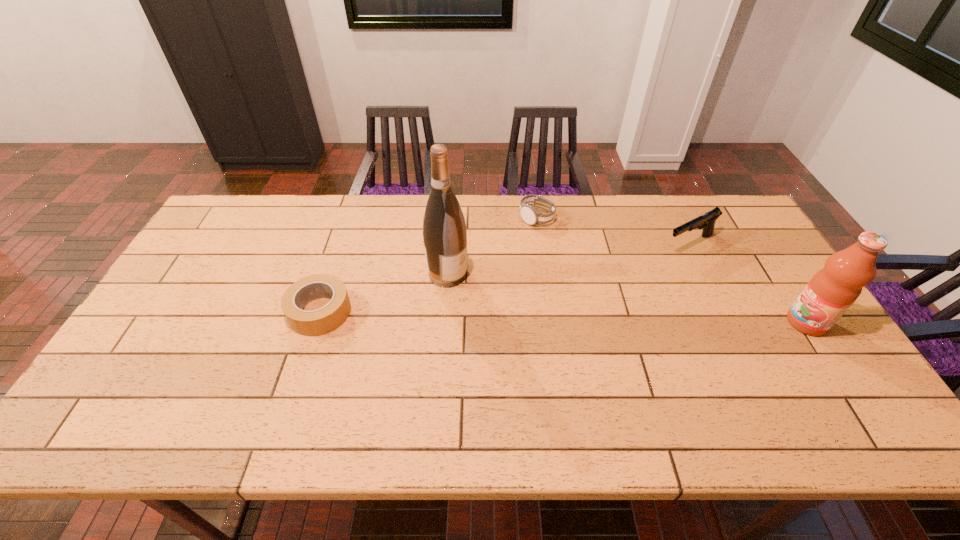
In the image, there is a desktop. Where is `vacant space at the far edge`? vacant space at the far edge is located at coordinates (515, 205).

Locate an element on the screen. blank area at the near edge is located at coordinates (708, 387).

The image size is (960, 540). Identify the location of vacant space at the left edge of the desktop. (196, 334).

In the image, there is a desktop. Where is `vacant space at the right edge`? This screenshot has height=540, width=960. vacant space at the right edge is located at coordinates (745, 254).

The height and width of the screenshot is (540, 960). Find the location of `blank area at the far left corner`. blank area at the far left corner is located at coordinates (276, 198).

You are a GUI agent. You are given a task and a screenshot of the screen. Output one action in this format:
    pyautogui.click(x=<x>, y=<y>)
    Task: Click on the vacant space at the far right corner of the desktop
    The height and width of the screenshot is (540, 960).
    Given the screenshot: What is the action you would take?
    pyautogui.click(x=692, y=207)

Find the location of a particular element. vacant space that is in between the third nearest object and the duct tape is located at coordinates (383, 293).

Locate an element on the screen. vacant area that lies between the second shortest object and the gun is located at coordinates (612, 231).

You are a GUI agent. You are given a task and a screenshot of the screen. Output one action in this format:
    pyautogui.click(x=<x>, y=<y>)
    Task: Click on the free space between the watch and the tallest object
    
    Given the screenshot: What is the action you would take?
    pyautogui.click(x=492, y=246)

The width and height of the screenshot is (960, 540). I want to click on unoccupied position between the wine bottle and the second shortest object, so click(x=492, y=246).